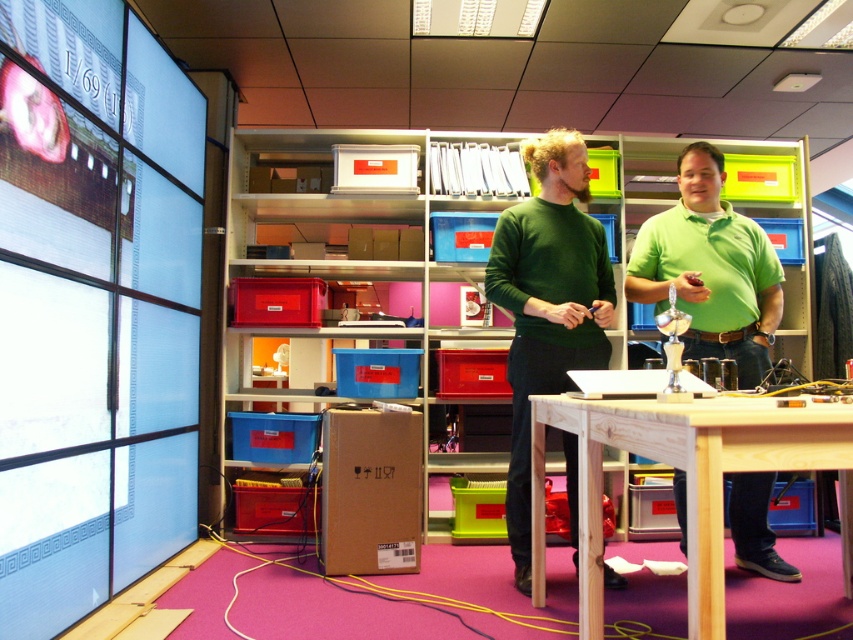
You are organizing a meeting in the office and need to place a 1.2 meter wide whiteboard between the light brown wood table at center and the green matte shirt at center. Can the whiteboard fit between them based on their widths?

The light brown wood table at center is wider than the green matte shirt at center. However, since the exact widths are not provided, it is impossible to determine if the 1.2 meter whiteboard can fit between them.

You are a delivery person who needs to place a package on the light brown wood table at center. The package is 12 inches wide. Can you fit the package on the table without it overlapping the green matte shirt at center?

The light brown wood table at center and green matte shirt at center are 36.00 inches apart. Since the package is only 12 inches wide, there is enough space between them to place the package on the table without overlapping the green matte shirt at center.